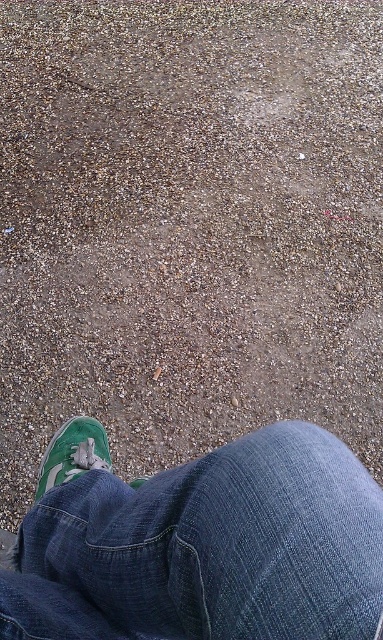
This screenshot has height=640, width=383. What do you see at coordinates (199, 544) in the screenshot?
I see `denim at lower center` at bounding box center [199, 544].

Is point (288, 627) closer to camera compared to point (99, 426)?

Yes, it is.

The image size is (383, 640). Identify the location of denim at lower center. (199, 544).